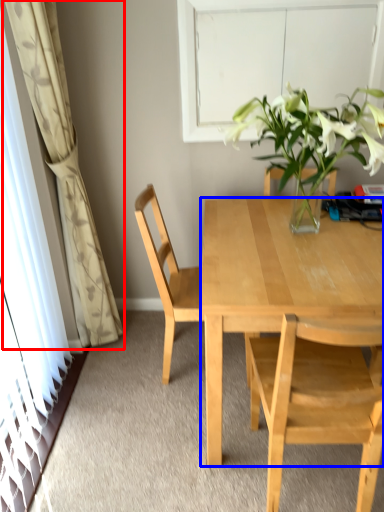
Question: Which point is closer to the camera, curtain (highlighted by a red box) or desk (highlighted by a blue box)?

Choices:
 (A) curtain
 (B) desk

Answer: (B)